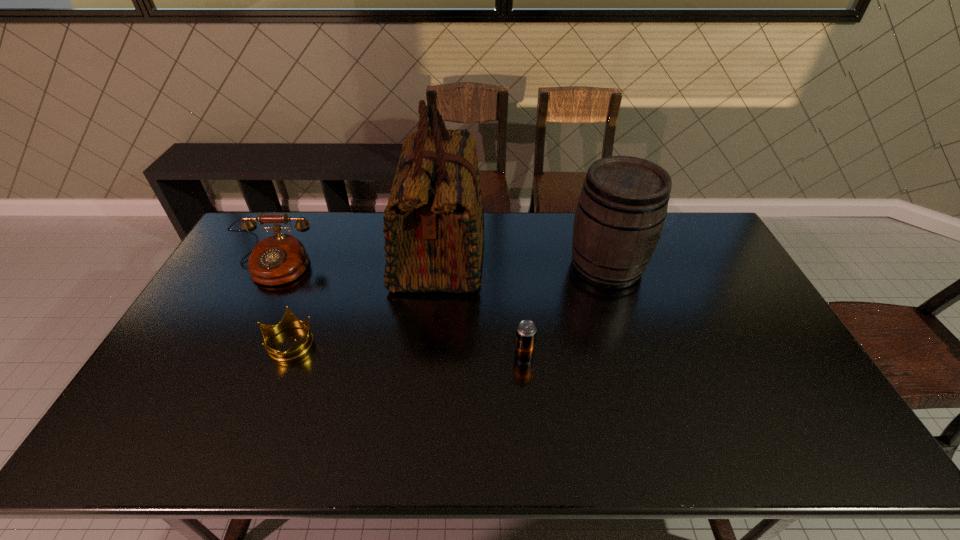
Identify the location of vacant space located on the dial of the third tallest object. (230, 352).

You are a GUI agent. You are given a task and a screenshot of the screen. Output one action in this format:
    pyautogui.click(x=<x>, y=<y>)
    Task: Click on the vacant space located on the right of the second object from right to left
    Image resolution: width=960 pixels, height=540 pixels.
    Given the screenshot: What is the action you would take?
    pyautogui.click(x=594, y=356)

Locate an element on the screen. free region located on the back of the shortest object is located at coordinates (312, 287).

Where is `shopping bag at the far edge`? The width and height of the screenshot is (960, 540). shopping bag at the far edge is located at coordinates tap(433, 224).

The height and width of the screenshot is (540, 960). Identify the location of wine bucket that is at the far edge. (622, 207).

Locate an element on the screen. telephone that is at the far edge is located at coordinates (279, 259).

Find the location of `object that is at the left edge`. object that is at the left edge is located at coordinates (279, 259).

The width and height of the screenshot is (960, 540). Identify the location of object situated at the far left corner. (279, 259).

You are a GUI agent. You are given a task and a screenshot of the screen. Output one action in this format:
    pyautogui.click(x=<x>, y=<y>)
    Task: Click on the vacant point at the far edge
    Image resolution: width=960 pixels, height=540 pixels.
    Given the screenshot: What is the action you would take?
    pyautogui.click(x=492, y=250)

Where is `vacant space at the near edge of the desktop`? This screenshot has height=540, width=960. vacant space at the near edge of the desktop is located at coordinates (332, 455).